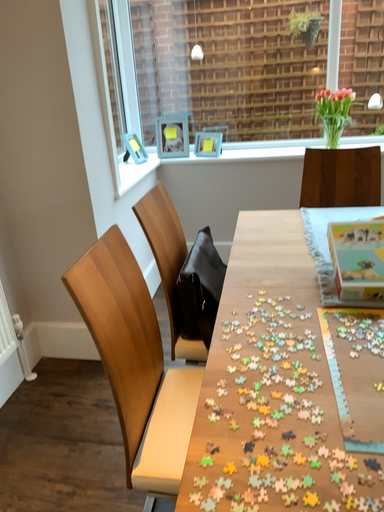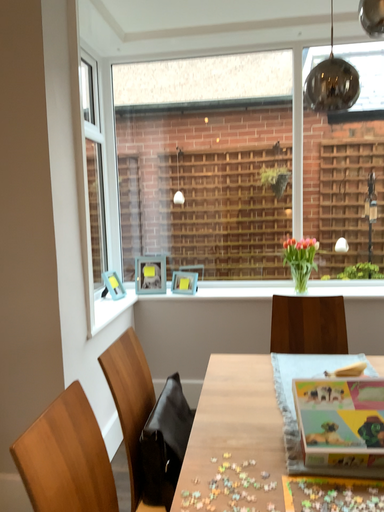
Question: Which way did the camera rotate in the video?

Choices:
 (A) rotated downward
 (B) rotated upward

Answer: (B)